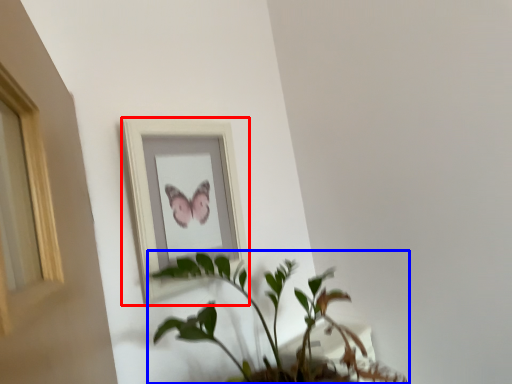
Question: Which of the following is the closest to the observer, picture frame (highlighted by a red box) or houseplant (highlighted by a blue box)?

Choices:
 (A) picture frame
 (B) houseplant

Answer: (B)